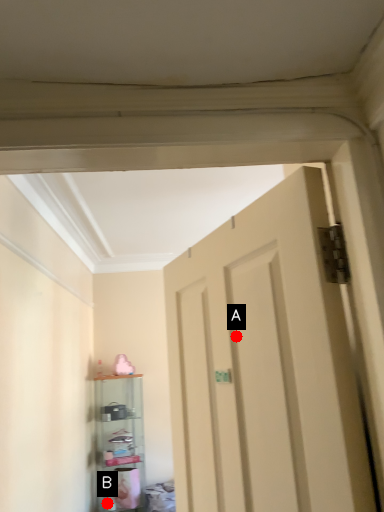
Question: Two points are circled on the image, labeled by A and B beside each circle. Which point is closer to the camera taking this photo?

Choices:
 (A) A is closer
 (B) B is closer

Answer: (A)